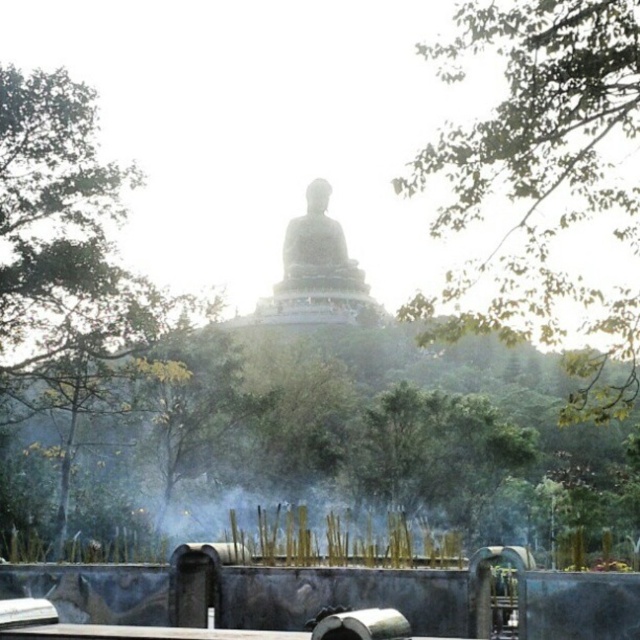
You are a photographer planning to capture the white marble statue at center and the green leafy tree at upper right in a single frame. Based on their sizes, which object should you focus on to ensure both are clearly visible in the photo?

The green leafy tree at upper right is bigger than the white marble statue at center, so focusing on the white marble statue at center will allow both objects to be clearly visible in the photo.

You are standing at the base of the hill where the Buddha statue is located. You notice two green leafy trees in the scene. Which tree, the green leafy tree at upper right or the green leafy tree at left, is closer to the Buddha statue?

The green leafy tree at upper right is positioned over the green leafy tree at left, meaning it is closer to the Buddha statue.

You are a photographer planning to capture the white marble statue at center and the green leafy tree at upper right in a single frame. Based on their heights, which object would appear taller in the photo?

The green leafy tree at upper right would appear taller in the photo since it has a greater height compared to the white marble statue at center according to the description.